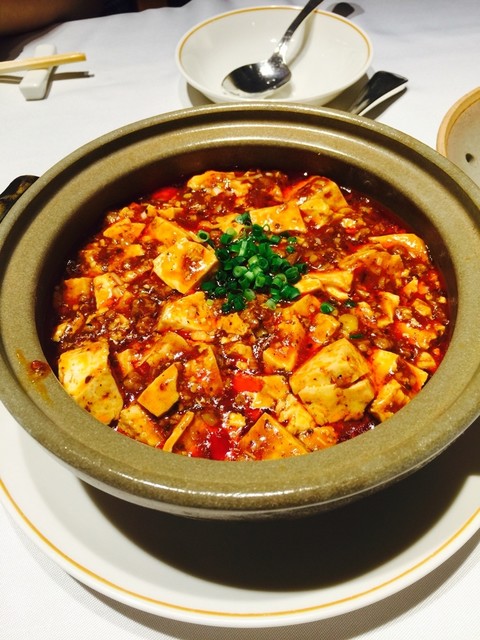
Find the location of `white surface`. white surface is located at coordinates (469, 612).